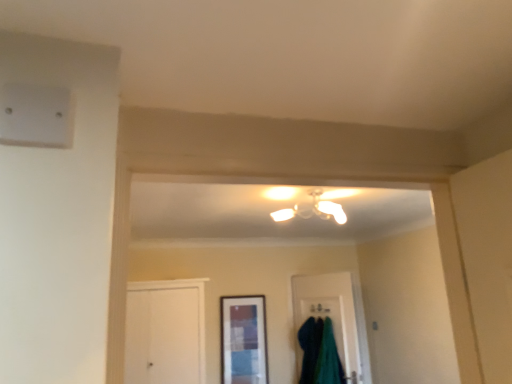
Question: Can you confirm if teal fuzzy robe at lower center is shorter than matte glass window at center?

Choices:
 (A) no
 (B) yes

Answer: (B)

Question: Is teal fuzzy robe at lower center facing towards matte glass window at center?

Choices:
 (A) no
 (B) yes

Answer: (A)

Question: Does teal fuzzy robe at lower center contain matte glass window at center?

Choices:
 (A) yes
 (B) no

Answer: (B)

Question: From a real-world perspective, is teal fuzzy robe at lower center beneath matte glass window at center?

Choices:
 (A) yes
 (B) no

Answer: (A)

Question: Is teal fuzzy robe at lower center turned away from matte glass window at center?

Choices:
 (A) yes
 (B) no

Answer: (B)

Question: In the image, is green fabric at lower center positioned in front of or behind matte white chandelier at center?

Choices:
 (A) front
 (B) behind

Answer: (B)

Question: Considering the positions of green fabric at lower center and matte white chandelier at center in the image, is green fabric at lower center wider or thinner than matte white chandelier at center?

Choices:
 (A) thin
 (B) wide

Answer: (A)

Question: Looking at the image, does green fabric at lower center seem bigger or smaller compared to matte white chandelier at center?

Choices:
 (A) big
 (B) small

Answer: (A)

Question: Based on their positions, is green fabric at lower center located to the left or right of matte white chandelier at center?

Choices:
 (A) left
 (B) right

Answer: (B)

Question: Is teal fuzzy robe at lower center wider or thinner than matte white chandelier at center?

Choices:
 (A) wide
 (B) thin

Answer: (B)

Question: Is teal fuzzy robe at lower center situated inside matte white chandelier at center or outside?

Choices:
 (A) outside
 (B) inside

Answer: (A)

Question: Is point (334, 360) positioned closer to the camera than point (332, 201)?

Choices:
 (A) farther
 (B) closer

Answer: (A)

Question: Considering the positions of teal fuzzy robe at lower center and matte white chandelier at center in the image, is teal fuzzy robe at lower center taller or shorter than matte white chandelier at center?

Choices:
 (A) tall
 (B) short

Answer: (A)

Question: Is matte white chandelier at center inside or outside of teal fuzzy robe at lower center?

Choices:
 (A) outside
 (B) inside

Answer: (A)

Question: Would you say matte white chandelier at center is to the left or to the right of teal fuzzy robe at lower center in the picture?

Choices:
 (A) left
 (B) right

Answer: (A)